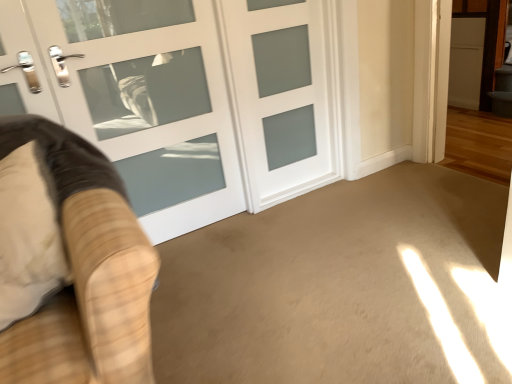
Question: Is velvet beige armchair at left turned away from white frosted glass door at center, positioned as the 2th door in right-to-left order?

Choices:
 (A) yes
 (B) no

Answer: (A)

Question: Could you tell me if velvet beige armchair at left is turned towards white frosted glass door at center, positioned as the 2th door in right-to-left order?

Choices:
 (A) yes
 (B) no

Answer: (B)

Question: Is velvet beige armchair at left further to the viewer compared to white frosted glass door at center, positioned as the 1th door in left-to-right order?

Choices:
 (A) yes
 (B) no

Answer: (B)

Question: Can you confirm if velvet beige armchair at left is smaller than white frosted glass door at center, positioned as the 1th door in left-to-right order?

Choices:
 (A) no
 (B) yes

Answer: (B)

Question: Does velvet beige armchair at left have a lesser width compared to white frosted glass door at center, positioned as the 1th door in left-to-right order?

Choices:
 (A) no
 (B) yes

Answer: (A)

Question: In the image, is white frosted glass door at center, the second door from the left, on the left side or the right side of beige carpet at center?

Choices:
 (A) right
 (B) left

Answer: (B)

Question: In terms of size, does white frosted glass door at center, the second door from the left, appear bigger or smaller than beige carpet at center?

Choices:
 (A) small
 (B) big

Answer: (A)

Question: Does point (307, 175) appear closer or farther from the camera than point (391, 314)?

Choices:
 (A) closer
 (B) farther

Answer: (B)

Question: Is white frosted glass door at center, which is the 1th door in right-to-left order, inside the boundaries of beige carpet at center, or outside?

Choices:
 (A) outside
 (B) inside

Answer: (A)

Question: Would you say velvet beige armchair at left is to the left or to the right of white frosted glass door at center, which is the 1th door in right-to-left order, in the picture?

Choices:
 (A) right
 (B) left

Answer: (B)

Question: From the image's perspective, is velvet beige armchair at left above or below white frosted glass door at center, the second door from the left?

Choices:
 (A) below
 (B) above

Answer: (A)

Question: Does point (113, 203) appear closer or farther from the camera than point (287, 165)?

Choices:
 (A) closer
 (B) farther

Answer: (A)

Question: From a real-world perspective, is velvet beige armchair at left positioned above or below white frosted glass door at center, the second door from the left?

Choices:
 (A) above
 (B) below

Answer: (A)

Question: Is white frosted glass door at center, which is the 1th door in right-to-left order, taller or shorter than white frosted glass door at center, positioned as the 2th door in right-to-left order?

Choices:
 (A) short
 (B) tall

Answer: (A)

Question: From a real-world perspective, is white frosted glass door at center, the second door from the left, above or below white frosted glass door at center, positioned as the 1th door in left-to-right order?

Choices:
 (A) above
 (B) below

Answer: (B)